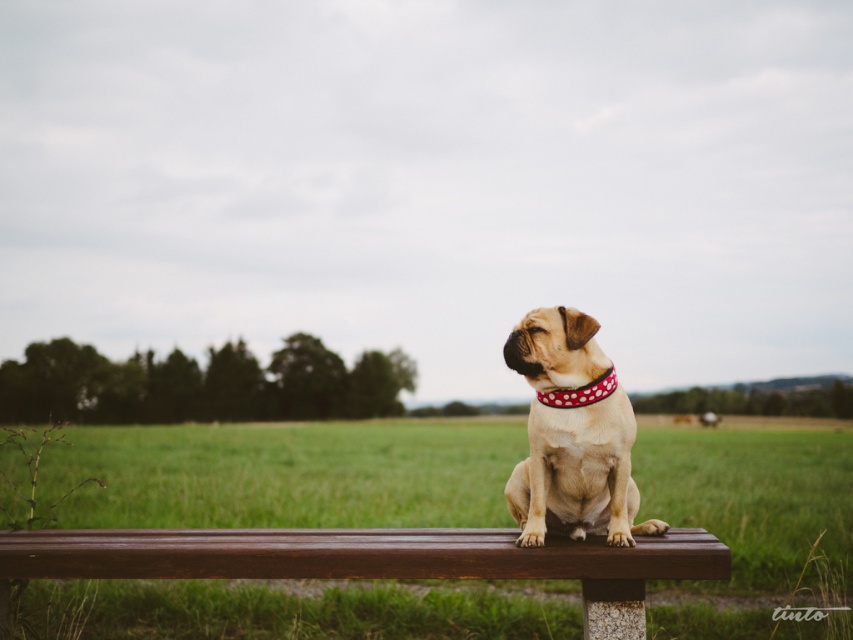
Question: Among these objects, which one is nearest to the camera?

Choices:
 (A) red dotted fabric neckband at center
 (B) light brown fur at center

Answer: (B)

Question: Is wooden bench at center positioned behind red dotted fabric neckband at center?

Choices:
 (A) yes
 (B) no

Answer: (B)

Question: Does brown wooden bench at center appear under red dotted fabric neckband at center?

Choices:
 (A) no
 (B) yes

Answer: (B)

Question: Can you confirm if wooden bench at center is thinner than light brown fur at center?

Choices:
 (A) yes
 (B) no

Answer: (B)

Question: Estimate the real-world distances between objects in this image. Which object is closer to the light brown fur at center?

Choices:
 (A) wooden bench at center
 (B) red dotted fabric neckband at center

Answer: (B)

Question: Which point is closer to the camera?

Choices:
 (A) wooden bench at center
 (B) light brown fur at center
 (C) red dotted fabric neckband at center

Answer: (A)